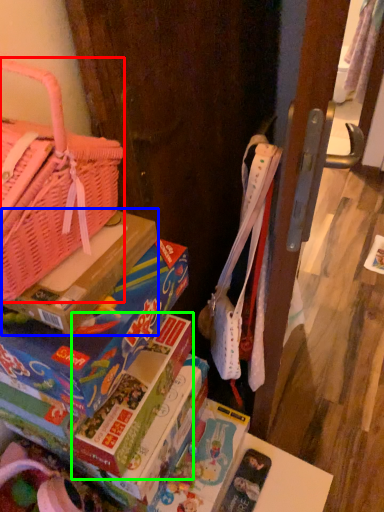
Question: Which object is positioned farthest from handbag (highlighted by a red box)? Select from cardboard box (highlighted by a blue box) and paperback book (highlighted by a green box).

Choices:
 (A) cardboard box
 (B) paperback book

Answer: (B)